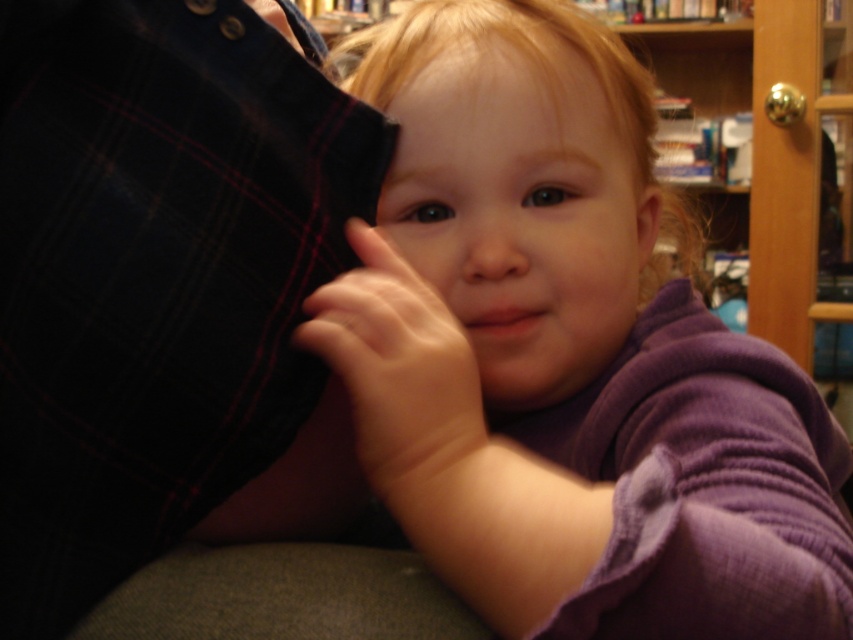
Between point (792, 464) and point (387, 472), which one is positioned in front?

Point (387, 472)

Between purple soft fabric baby at center and smooth skin hand at center, which one appears on the left side from the viewer's perspective?

From the viewer's perspective, smooth skin hand at center appears more on the left side.

The height and width of the screenshot is (640, 853). Identify the location of purple soft fabric baby at center. (566, 356).

Where is `purple soft fabric baby at center`? This screenshot has width=853, height=640. purple soft fabric baby at center is located at coordinates (566, 356).